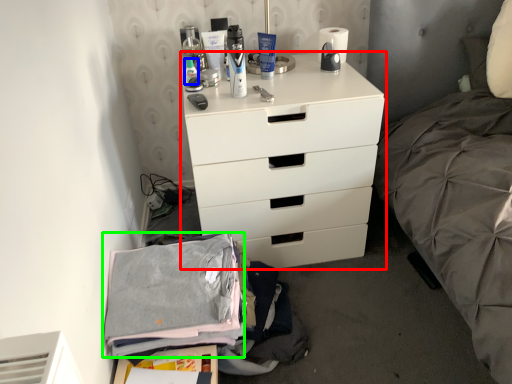
Question: Considering the real-world distances, which object is farthest from chest of drawers (highlighted by a red box)? toiletry (highlighted by a blue box) or clothing (highlighted by a green box)?

Choices:
 (A) toiletry
 (B) clothing

Answer: (A)